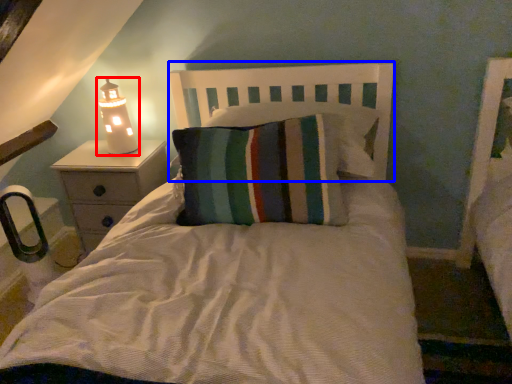
Question: Among these objects, which one is farthest to the camera, lamp (highlighted by a red box) or headboard (highlighted by a blue box)?

Choices:
 (A) lamp
 (B) headboard

Answer: (A)